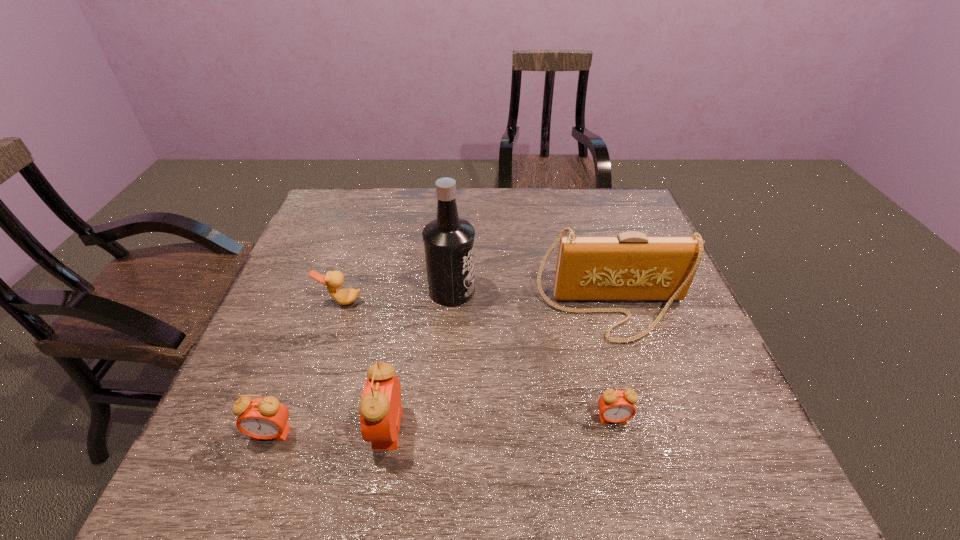
Image resolution: width=960 pixels, height=540 pixels. In order to click on free spot that satisfies the following two spatial constraints: 1. on the face of the rightmost alarm clock; 2. on the face of the third object from left to right in this screenshot , I will do `click(615, 428)`.

Locate an element on the screen. The image size is (960, 540). vacant region that satisfies the following two spatial constraints: 1. on the front label of the third object from right to left; 2. on the beak of the duck is located at coordinates (451, 301).

Where is `vacant space that satisfies the following two spatial constraints: 1. on the face of the rightmost alarm clock; 2. on the face of the second alarm clock from left to right`? This screenshot has height=540, width=960. vacant space that satisfies the following two spatial constraints: 1. on the face of the rightmost alarm clock; 2. on the face of the second alarm clock from left to right is located at coordinates (615, 428).

The image size is (960, 540). In order to click on free spot that satisfies the following two spatial constraints: 1. on the decorative side of the handbag; 2. on the face of the tallest alarm clock in this screenshot , I will do `click(648, 428)`.

Where is `vacant space that satisfies the following two spatial constraints: 1. on the decorative side of the handbag; 2. on the face of the second alarm clock from left to right`? vacant space that satisfies the following two spatial constraints: 1. on the decorative side of the handbag; 2. on the face of the second alarm clock from left to right is located at coordinates (648, 428).